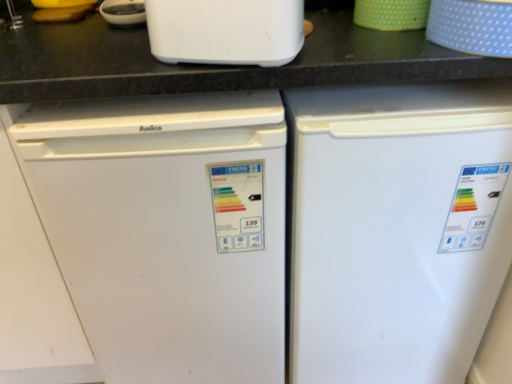
This screenshot has width=512, height=384. Identify the location of vacant space that is to the left of white plastic toaster at upper center. (100, 66).